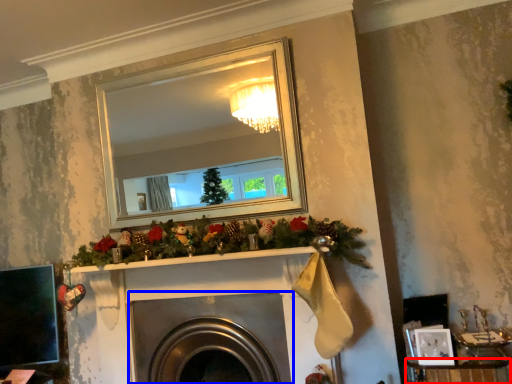
Question: Which point is closer to the camera, furniture (highlighted by a red box) or fireplace (highlighted by a blue box)?

Choices:
 (A) furniture
 (B) fireplace

Answer: (A)